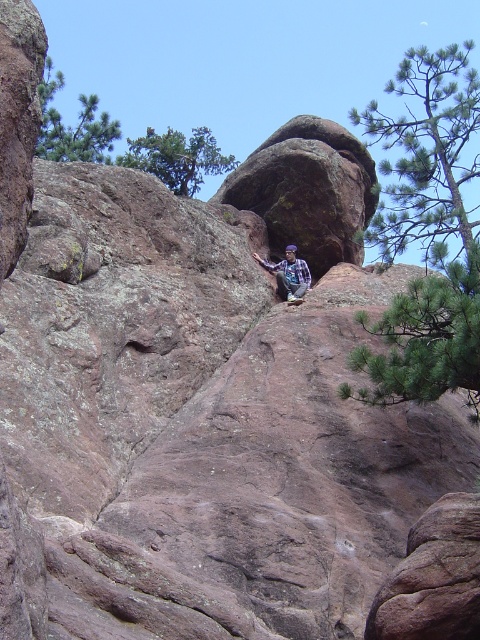
Question: Which object is farther from the camera taking this photo?

Choices:
 (A) green textured pine tree at upper left
 (B) plaid fabric shirt at center
 (C) green needle-like leaves at upper right
 (D) green leafy tree at upper left

Answer: (D)

Question: Estimate the real-world distances between objects in this image. Which object is closer to the green leafy tree at upper left?

Choices:
 (A) plaid fabric shirt at center
 (B) green textured pine tree at upper left

Answer: (B)

Question: Does green pine branch at upper right appear under green leafy tree at upper left?

Choices:
 (A) yes
 (B) no

Answer: (A)

Question: Is green needle-like leaves at upper right below green pine branch at upper right?

Choices:
 (A) yes
 (B) no

Answer: (B)

Question: Can you confirm if green pine branch at upper right is bigger than green leafy tree at upper left?

Choices:
 (A) yes
 (B) no

Answer: (B)

Question: Which is farther from the green needle-like leaves at upper right?

Choices:
 (A) plaid fabric shirt at center
 (B) green textured pine tree at upper left

Answer: (B)